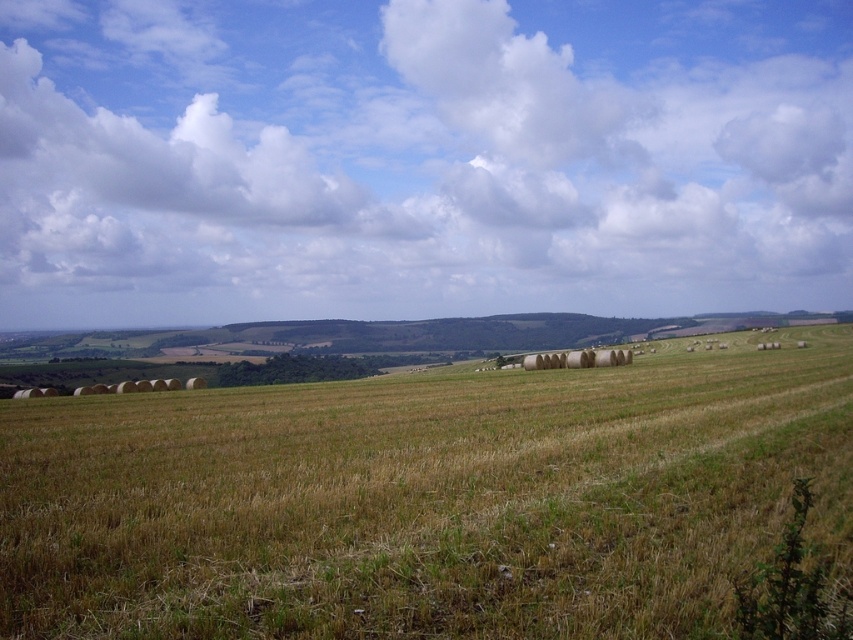
How far apart are white fluffy cloud at upper center and dry grass at center?

white fluffy cloud at upper center is 126.22 meters away from dry grass at center.

Can you confirm if white fluffy cloud at upper center is taller than dry grass at center?

Indeed, white fluffy cloud at upper center has a greater height compared to dry grass at center.

Which is in front, point (97, 12) or point (267, 410)?

Positioned in front is point (267, 410).

Locate an element on the screen. Image resolution: width=853 pixels, height=640 pixels. white fluffy cloud at upper center is located at coordinates (421, 160).